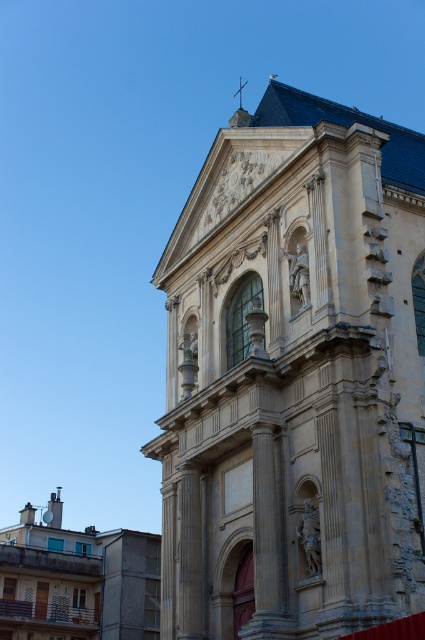
Question: Which of the following is the closest to the observer?

Choices:
 (A) beige stone church at center
 (B) matte stone church at lower left

Answer: (A)

Question: Does beige stone church at center appear over matte stone church at lower left?

Choices:
 (A) no
 (B) yes

Answer: (B)

Question: Where is beige stone church at center located in relation to matte stone church at lower left in the image?

Choices:
 (A) below
 (B) above

Answer: (B)

Question: Is beige stone church at center above matte stone church at lower left?

Choices:
 (A) yes
 (B) no

Answer: (A)

Question: Which of the following is the farthest from the observer?

Choices:
 (A) matte stone church at lower left
 (B) beige stone church at center

Answer: (A)